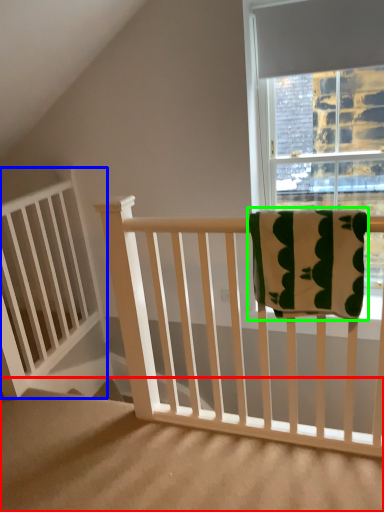
Question: Which object is positioned farthest from stairs (highlighted by a red box)? Select from balustrade (highlighted by a blue box) and beach towel (highlighted by a green box).

Choices:
 (A) balustrade
 (B) beach towel

Answer: (B)